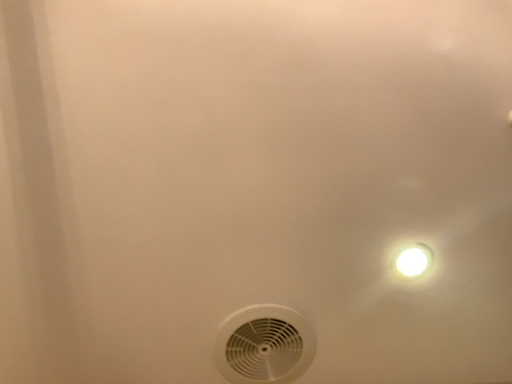
Question: Is white glossy light fixture at upper right thinner than white plastic mechanical fan at lower center?

Choices:
 (A) yes
 (B) no

Answer: (A)

Question: From the image's perspective, is white glossy light fixture at upper right located above white plastic mechanical fan at lower center?

Choices:
 (A) no
 (B) yes

Answer: (B)

Question: Considering the relative sizes of white glossy light fixture at upper right and white plastic mechanical fan at lower center in the image provided, is white glossy light fixture at upper right smaller than white plastic mechanical fan at lower center?

Choices:
 (A) no
 (B) yes

Answer: (B)

Question: Can you confirm if white glossy light fixture at upper right is bigger than white plastic mechanical fan at lower center?

Choices:
 (A) yes
 (B) no

Answer: (B)

Question: Is white glossy light fixture at upper right oriented away from white plastic mechanical fan at lower center?

Choices:
 (A) yes
 (B) no

Answer: (B)

Question: Does white glossy light fixture at upper right have a greater width compared to white plastic mechanical fan at lower center?

Choices:
 (A) no
 (B) yes

Answer: (A)

Question: From the image's perspective, is white plastic mechanical fan at lower center under white glossy light fixture at upper right?

Choices:
 (A) yes
 (B) no

Answer: (A)

Question: Is white plastic mechanical fan at lower center positioned in front of white glossy light fixture at upper right?

Choices:
 (A) yes
 (B) no

Answer: (B)

Question: Could you tell me if white plastic mechanical fan at lower center is facing white glossy light fixture at upper right?

Choices:
 (A) yes
 (B) no

Answer: (B)

Question: Is white plastic mechanical fan at lower center not close to white glossy light fixture at upper right?

Choices:
 (A) no
 (B) yes

Answer: (A)

Question: From a real-world perspective, does white plastic mechanical fan at lower center stand above white glossy light fixture at upper right?

Choices:
 (A) yes
 (B) no

Answer: (B)

Question: Can you confirm if white plastic mechanical fan at lower center is wider than white glossy light fixture at upper right?

Choices:
 (A) yes
 (B) no

Answer: (A)

Question: Which is correct: white plastic mechanical fan at lower center is inside white glossy light fixture at upper right, or outside of it?

Choices:
 (A) inside
 (B) outside

Answer: (B)